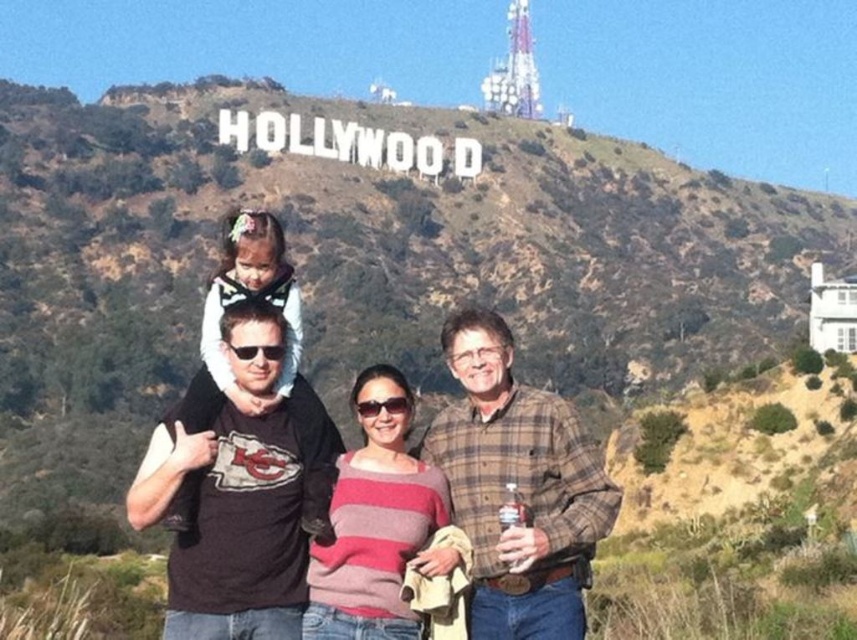
Question: Which point is farther from the camera taking this photo?

Choices:
 (A) (481, 592)
 (B) (207, 410)
 (C) (358, 588)
 (D) (250, 241)

Answer: (D)

Question: Can you confirm if black cotton shirt at center is thinner than plaid flannel shirt at center?

Choices:
 (A) no
 (B) yes

Answer: (A)

Question: Can you confirm if black cotton t-shirt at center is positioned to the right of plaid flannel shirt at center?

Choices:
 (A) no
 (B) yes

Answer: (A)

Question: Is black cotton t-shirt at center below black cotton shirt at center?

Choices:
 (A) no
 (B) yes

Answer: (B)

Question: Which object is the farthest from the black cotton shirt at center?

Choices:
 (A) pink striped sweater at center
 (B) black cotton t-shirt at center
 (C) plaid flannel shirt at center

Answer: (B)

Question: Which point is closer to the camera?

Choices:
 (A) plaid flannel shirt at center
 (B) pink striped sweater at center
 (C) black cotton shirt at center

Answer: (B)